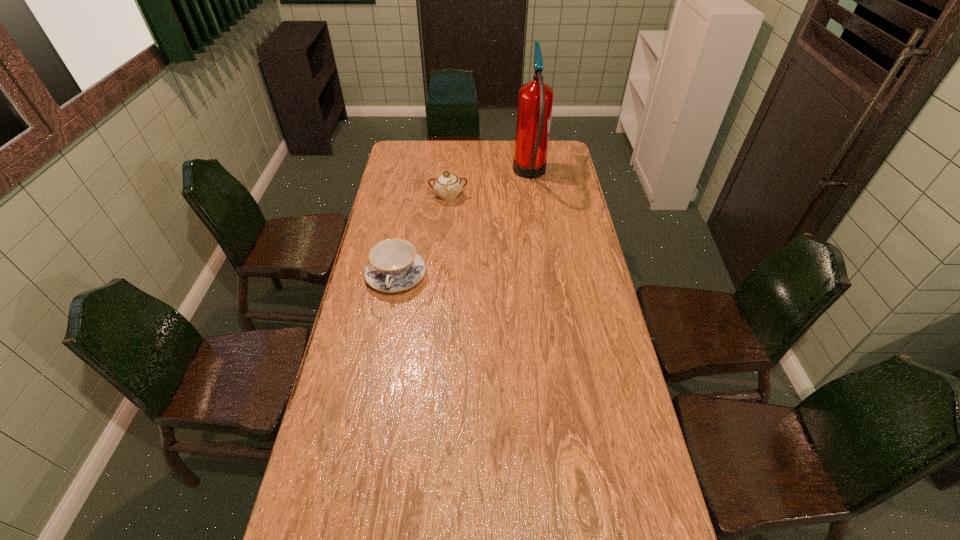
This screenshot has height=540, width=960. What are the coordinates of `vacant space that is in between the nearer chinaware and the fire extinguisher` in the screenshot? It's located at (464, 226).

At what (x,y) coordinates should I click in order to perform the action: click on blank region between the tallest object and the second shortest object. Please return your answer as a coordinate pair (x, y). The width and height of the screenshot is (960, 540). Looking at the image, I should click on (490, 186).

Where is `empty space that is in between the rightmost object and the second tallest object`? empty space that is in between the rightmost object and the second tallest object is located at coordinates (490, 186).

In order to click on vacant area between the nearest object and the tallest object in this screenshot , I will do `click(464, 226)`.

Find the location of a particular element. The height and width of the screenshot is (540, 960). vacant area that lies between the nearer chinaware and the second tallest object is located at coordinates (422, 236).

Where is `empty location between the shortest object and the fire extinguisher`? The image size is (960, 540). empty location between the shortest object and the fire extinguisher is located at coordinates (464, 226).

Identify the location of the closest object to the farther chinaware. (535, 99).

Where is `object that is the closest to the shorter chinaware`? object that is the closest to the shorter chinaware is located at coordinates (447, 186).